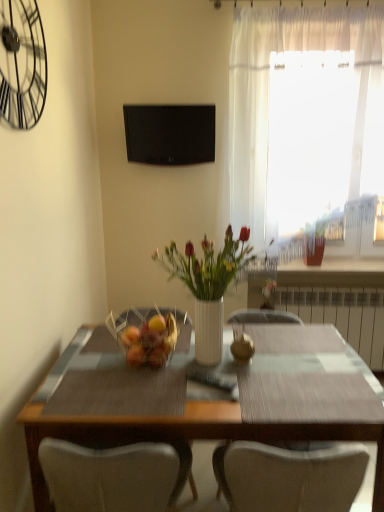
The width and height of the screenshot is (384, 512). What are the coordinates of `vacant region above translucent fabric curtain at upper right (from a real-world perspective)` in the screenshot? It's located at (307, 8).